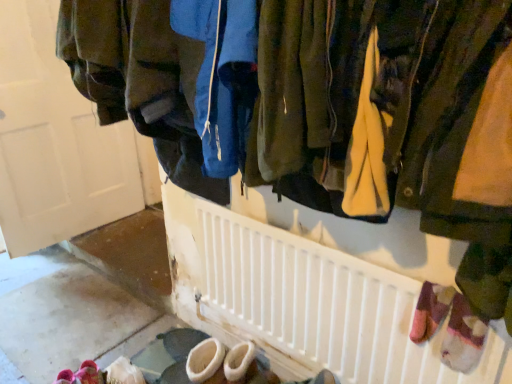
Find the location of a particular element. free location above white plastic radiator at center (from a real-world perspective) is located at coordinates (318, 243).